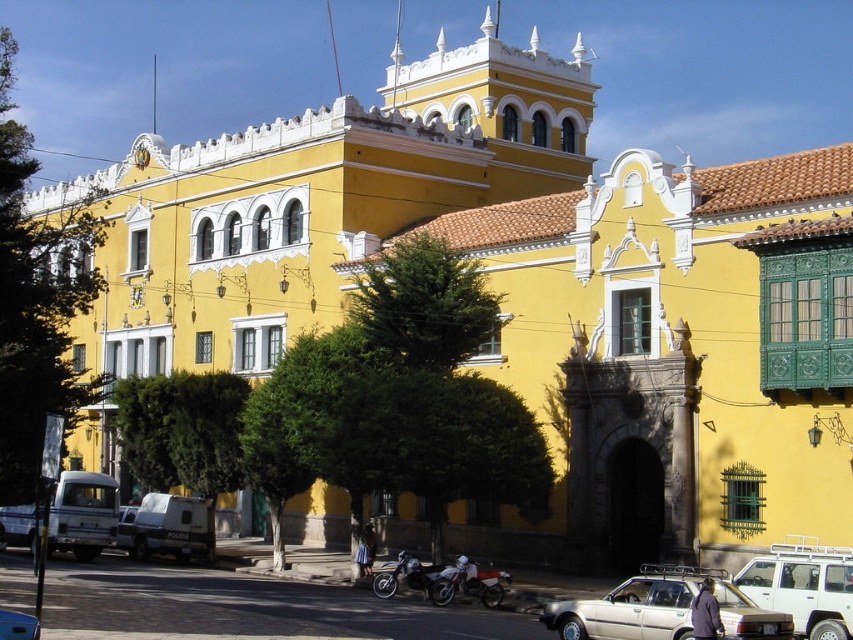
Question: Does white matte sedan at lower center come behind metallic silver car at lower left?

Choices:
 (A) yes
 (B) no

Answer: (A)

Question: Among these points, which one is nearest to the camera?

Choices:
 (A) (399, 577)
 (B) (556, 612)
 (C) (178, 522)
 (D) (490, 595)

Answer: (B)

Question: Which object appears farthest from the camera in this image?

Choices:
 (A) white matte van at center
 (B) shiny chrome motorcycle at lower center
 (C) metallic silver car at lower left
 (D) white matte sedan at lower center

Answer: (A)

Question: Is white matte suv at center wider than metallic silver car at lower left?

Choices:
 (A) yes
 (B) no

Answer: (A)

Question: Is white matte sedan at lower center below shiny chrome motorcycle at lower center?

Choices:
 (A) no
 (B) yes

Answer: (A)

Question: Which object is the closest to the shiny chrome motorcycle at lower center?

Choices:
 (A) white matte motorcycle at center
 (B) white matte sedan at lower center
 (C) white matte suv at center
 (D) metallic silver car at lower left

Answer: (A)